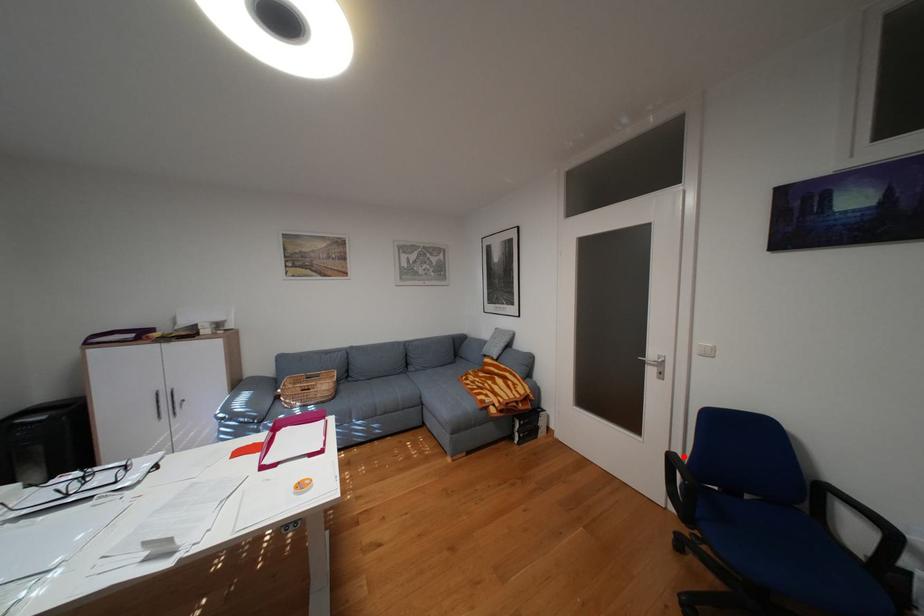
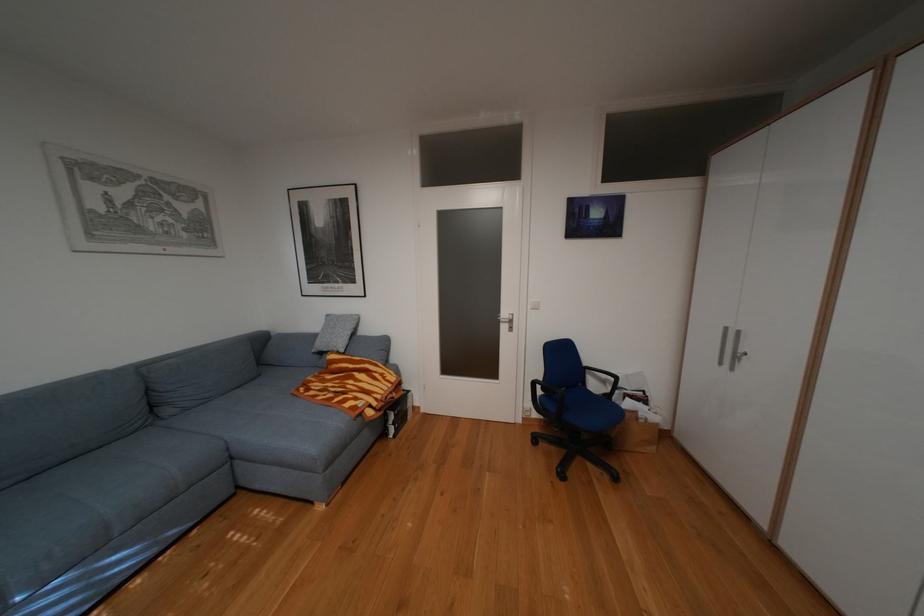
Locate, in the second image, the point that corresponds to the highlighted location in the first image.

(545, 383)